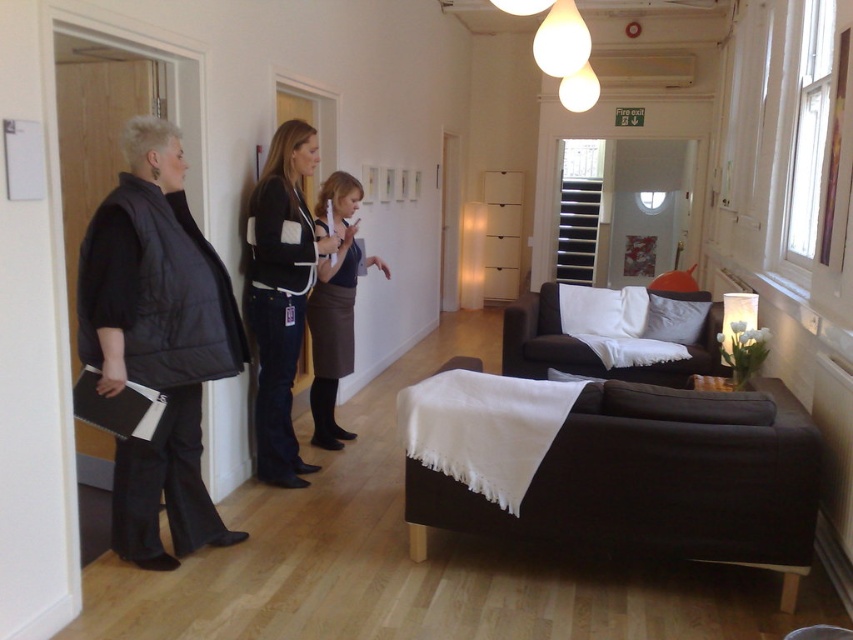
Question: Is brown skirt at center to the right of black fabric couch at center from the viewer's perspective?

Choices:
 (A) yes
 (B) no

Answer: (B)

Question: Which of the following is the closest to the observer?

Choices:
 (A) dark brown fabric couch at lower right
 (B) black puffer vest at left

Answer: (B)

Question: Does black puffer vest at left appear over black fabric couch at center?

Choices:
 (A) no
 (B) yes

Answer: (A)

Question: Which of the following is the closest to the observer?

Choices:
 (A) (712, 321)
 (B) (160, 262)
 (C) (529, 529)

Answer: (B)

Question: Is black puffer vest at left to the left of black denim jacket at center from the viewer's perspective?

Choices:
 (A) no
 (B) yes

Answer: (B)

Question: Estimate the real-world distances between objects in this image. Which object is farther from the dark brown fabric couch at lower right?

Choices:
 (A) black puffer vest at left
 (B) brown skirt at center

Answer: (B)